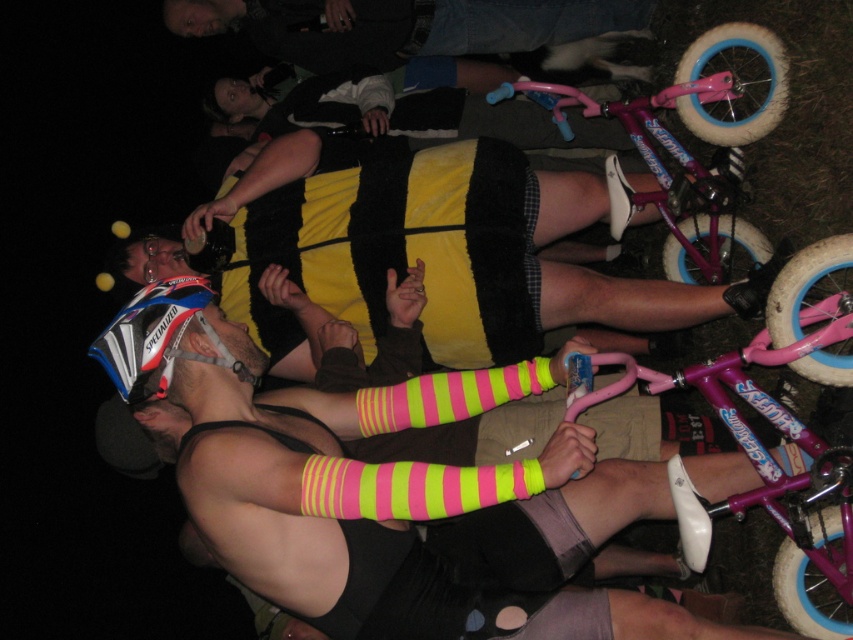
You are a photographer setting up a shoot in this nighttime scene. You need to decide which object, the denim pants at upper center or the matte black helmet at left, will require more space in your camera frame. Which one should you account for and why?

The denim pants at upper center has a larger size compared to the matte black helmet at left, so you should account for the denim pants at upper center in your camera frame as it occupies more space.

Based on the scene description, can you determine the spatial relationship between the denim pants at upper center and the matte black helmet at left?

The denim pants at upper center are located to the right of the matte black helmet at left according to the description.